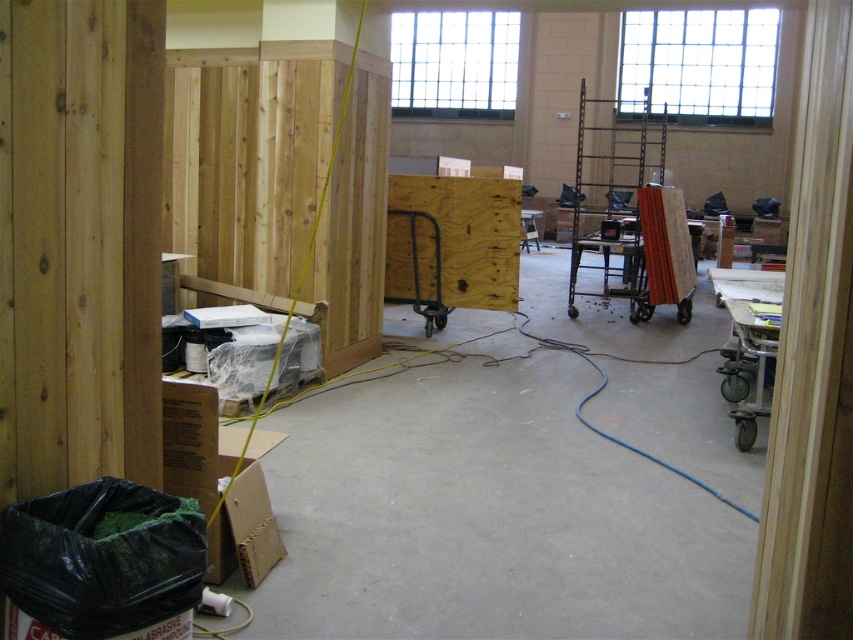
Question: Among these points, which one is nearest to the camera?

Choices:
 (A) (425, 216)
 (B) (612, 193)

Answer: (A)

Question: Is brown cardboard box at lower left below metallic silver cart at right?

Choices:
 (A) yes
 (B) no

Answer: (A)

Question: Based on their relative distances, which object is nearer to the metallic gray hand truck at center?

Choices:
 (A) brown cardboard box at lower left
 (B) metallic black rack at right
 (C) wooden boards at center-right
 (D) metallic silver cart at right

Answer: (C)

Question: Which object appears closest to the camera in this image?

Choices:
 (A) brown cardboard box at lower left
 (B) metallic silver cart at right
 (C) metallic black rack at right
 (D) metallic gray hand truck at center

Answer: (A)

Question: Does wooden boards at center-right appear over metallic gray hand truck at center?

Choices:
 (A) no
 (B) yes

Answer: (B)

Question: Does brown cardboard box at lower left lie behind wooden boards at center-right?

Choices:
 (A) yes
 (B) no

Answer: (B)